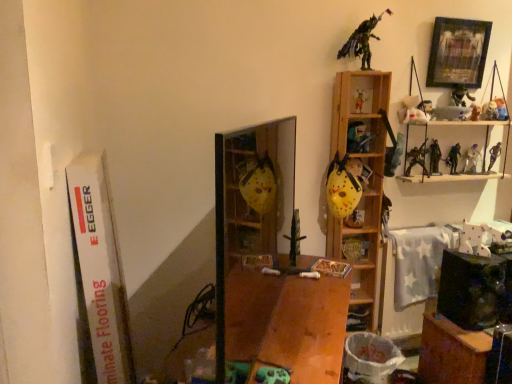
In order to click on vacant space underneath transparent plastic cabinet at center, which is counted as the 1th cabinet, starting from the front (from a real-world perspective) in this screenshot , I will do `click(261, 311)`.